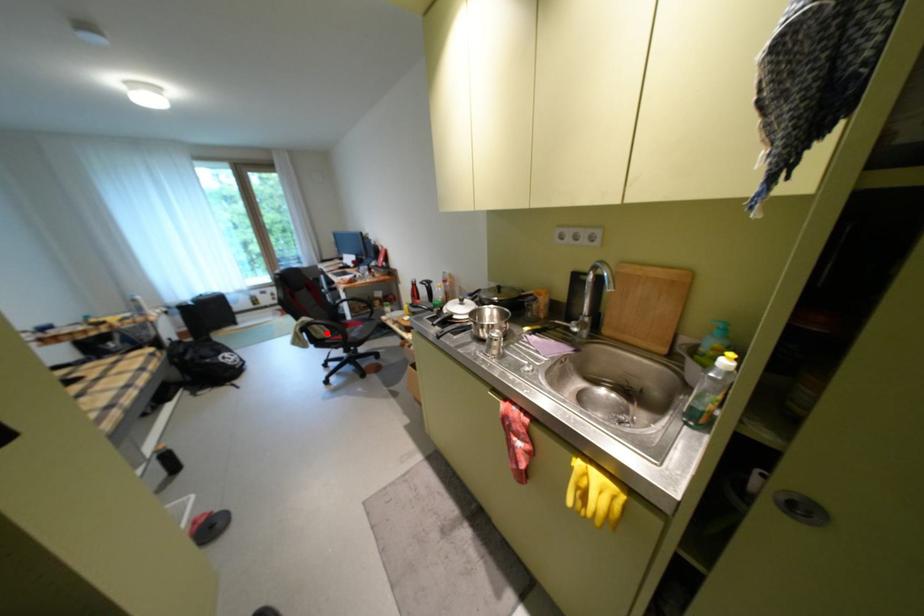
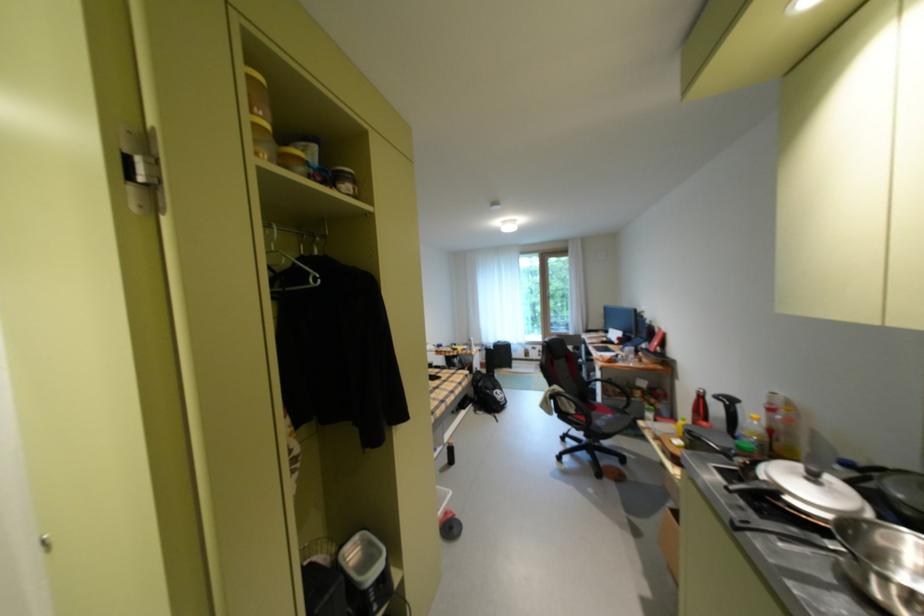
Locate, in the second image, the point that corresponds to the highlighted location in the first image.

(573, 405)